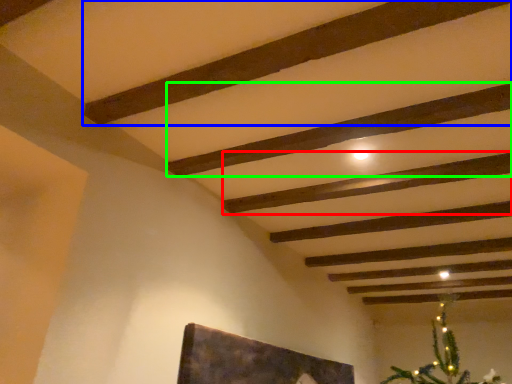
Question: Which is farther away from plank (highlighted by a red box)? plank (highlighted by a blue box) or plank (highlighted by a green box)?

Choices:
 (A) plank
 (B) plank

Answer: (A)